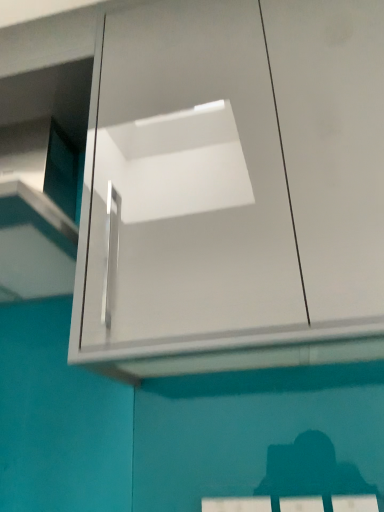
This screenshot has height=512, width=384. Describe the element at coordinates (233, 189) in the screenshot. I see `white glossy cabinet at upper center` at that location.

You are a GUI agent. You are given a task and a screenshot of the screen. Output one action in this format:
    pyautogui.click(x=<x>, y=<y>)
    Task: Click on the white glossy cabinet at upper center
    The image size is (384, 512).
    Given the screenshot: What is the action you would take?
    pyautogui.click(x=233, y=189)

Find the location of `white glossy cabinet at upper center`. white glossy cabinet at upper center is located at coordinates (233, 189).